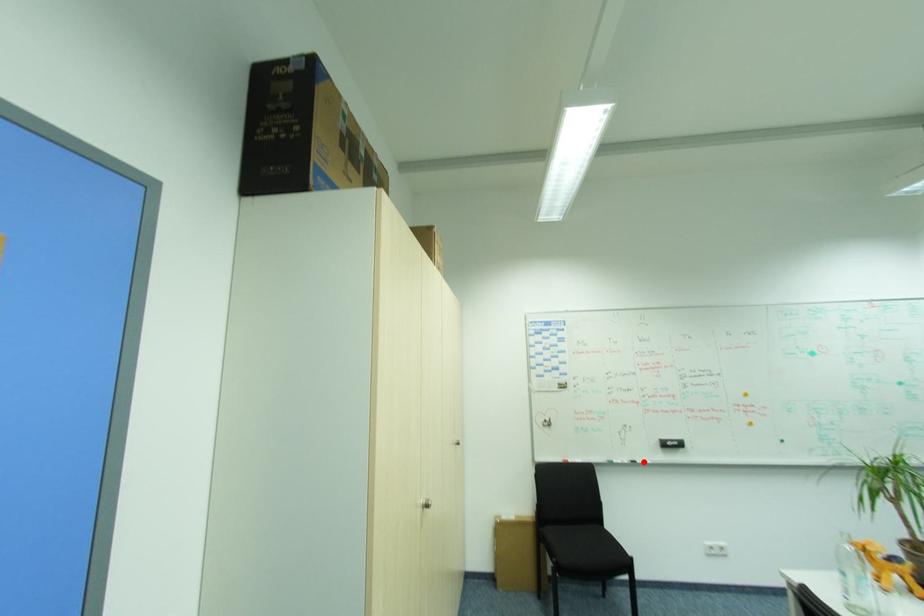
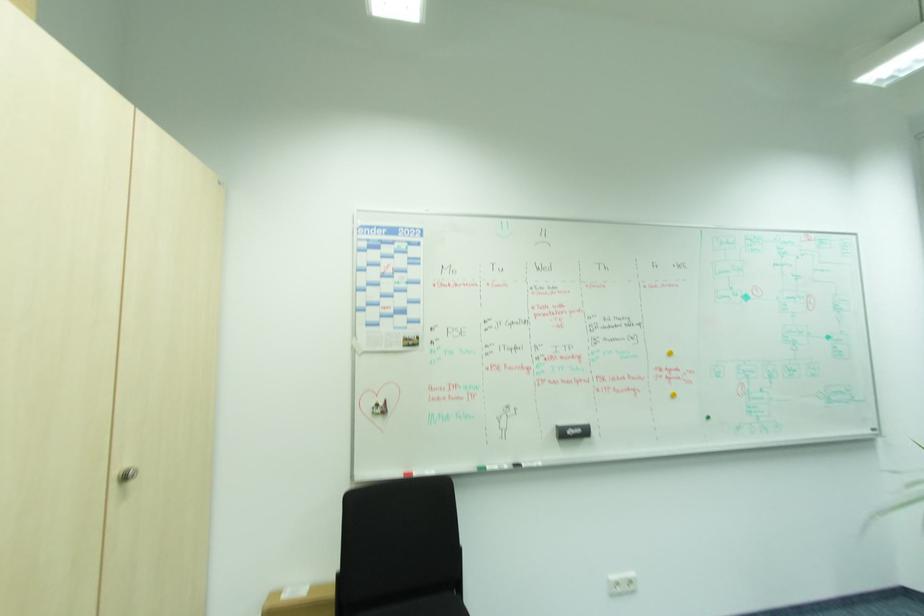
The point at the highlighted location is marked in the first image. Where is the corresponding point in the second image?

(528, 464)